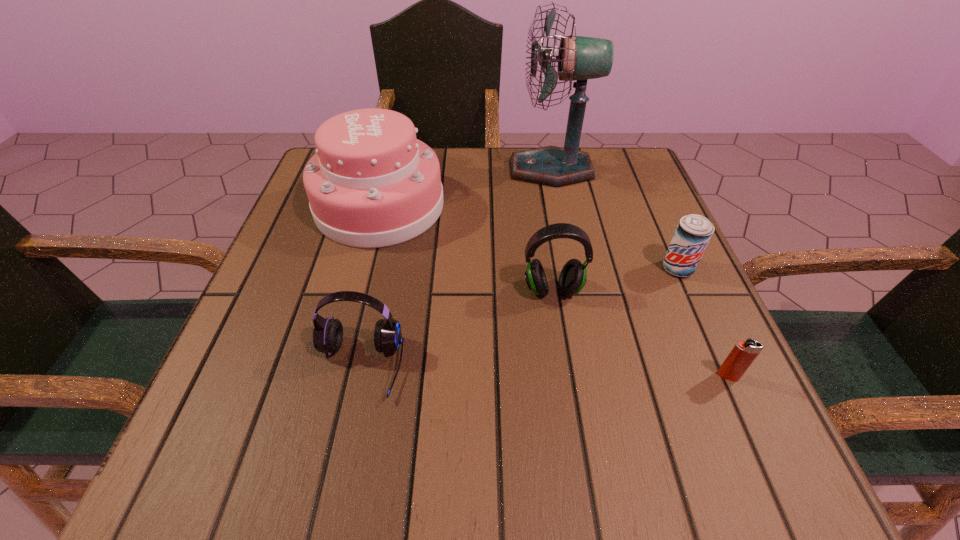
This screenshot has width=960, height=540. Identify the location of fan. (580, 58).

I want to click on birthday cake, so click(x=371, y=184).

Where is `the right headset`? Image resolution: width=960 pixels, height=540 pixels. the right headset is located at coordinates (572, 279).

Where is `the nearer headset`? This screenshot has width=960, height=540. the nearer headset is located at coordinates (328, 333).

This screenshot has height=540, width=960. What are the coordinates of `beer can` in the screenshot? It's located at (693, 233).

Locate an element on the screen. the shortest object is located at coordinates (742, 355).

Locate an element on the screen. The height and width of the screenshot is (540, 960). vacant area located in front of the fan where the wind blows is located at coordinates (473, 170).

In order to click on vacant point located 0.100m in front of the fan where the wind blows in this screenshot , I will do `click(469, 170)`.

Find the location of a particular element. The height and width of the screenshot is (540, 960). vacant space positioned in front of the fan where the wind blows is located at coordinates (441, 170).

At what (x,y) coordinates should I click in order to perform the action: click on blank space located on the back of the fifth shortest object. Please return your answer as a coordinate pair (x, y). Looking at the image, I should click on tap(394, 153).